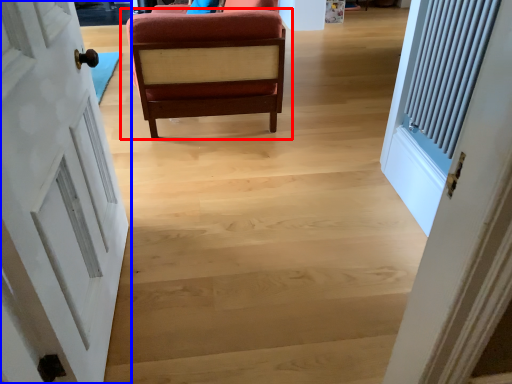
Question: Which point is further to the camera, chair (highlighted by a red box) or door (highlighted by a blue box)?

Choices:
 (A) chair
 (B) door

Answer: (A)